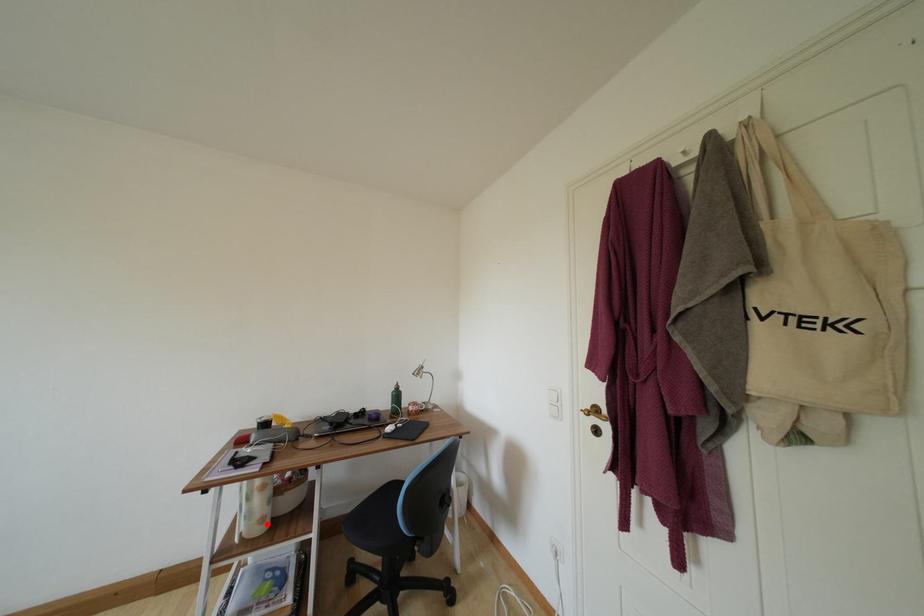
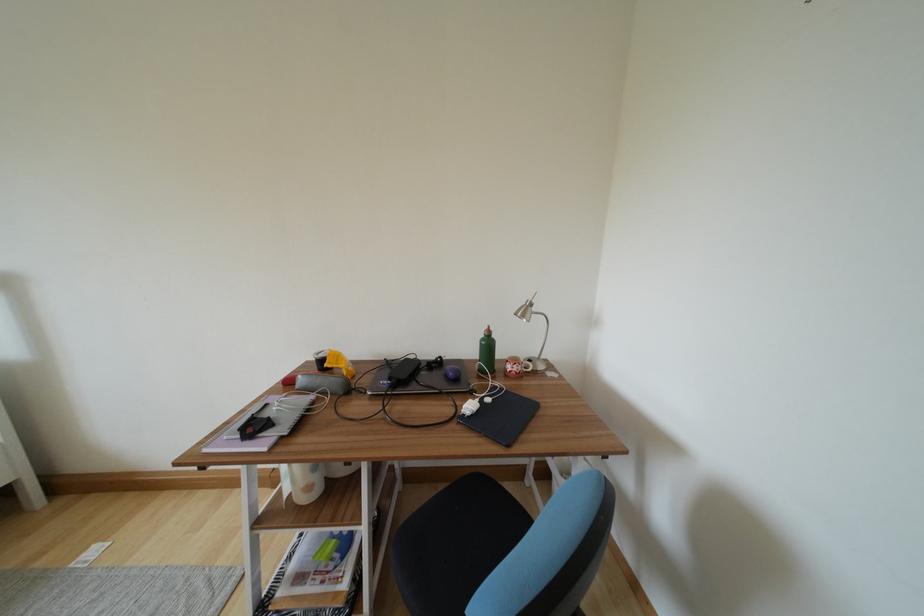
Find the pixel in the second image that matches the highlighted location in the first image.

(313, 492)